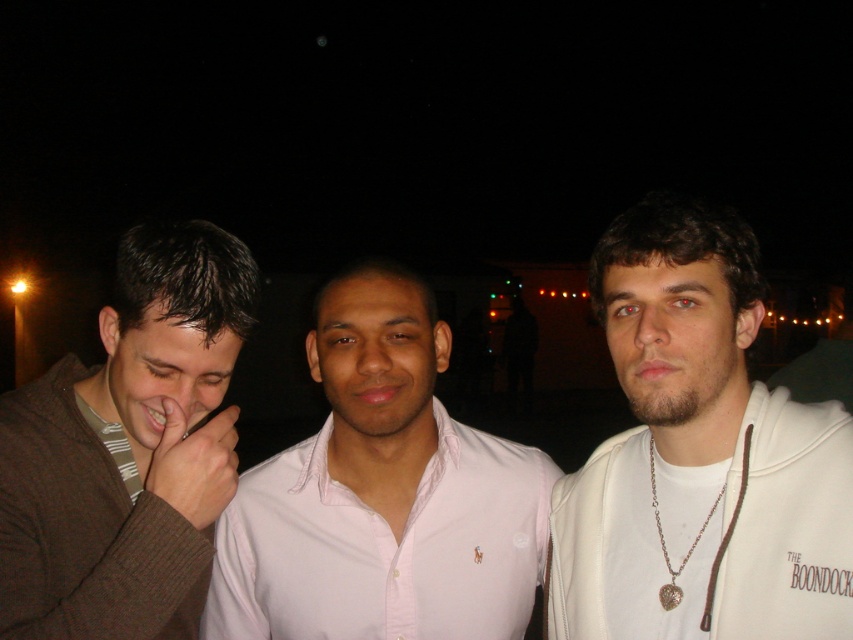
Which object is located at the coordinates point (699, 452)?

The point (699, 452) marks the white matte hoodie at center.

You are a photographer trying to capture a candid shot of the group. Since the lighting is focused on the subjects, you want to ensure that all three are visible. Given the positions of the white matte hoodie at center and the pink cotton shirt at center, which one is positioned to the right side of the other?

The white matte hoodie at center is to the right of the pink cotton shirt at center, so the white matte hoodie at center is positioned to the right side of the pink cotton shirt at center.

You are a photographer trying to capture a candid shot of the two subjects in the middle. The white matte hoodie at center and the matte brown hand at center are both in your frame. Which object is larger in size?

The white matte hoodie at center is bigger than the matte brown hand at center, so the photographer should focus on the larger object to ensure it fits within the frame.